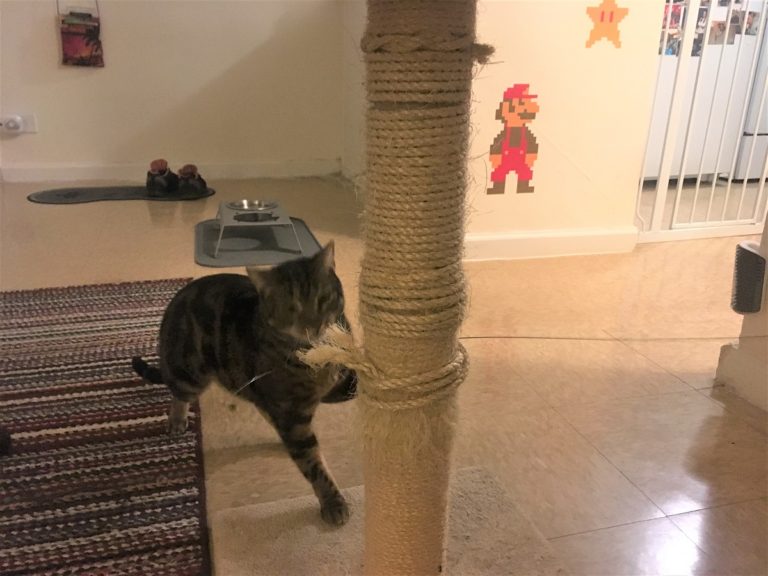
Locate an element on the screen. hanging decor is located at coordinates click(x=78, y=39).